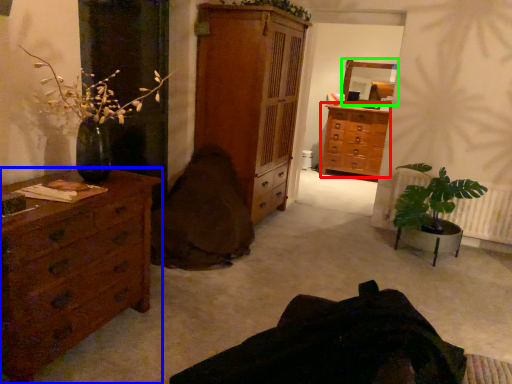
Question: Which object is the closest to the chest of drawers (highlighted by a red box)? Choose among these: chest of drawers (highlighted by a blue box) or mirror (highlighted by a green box).

Choices:
 (A) chest of drawers
 (B) mirror

Answer: (B)